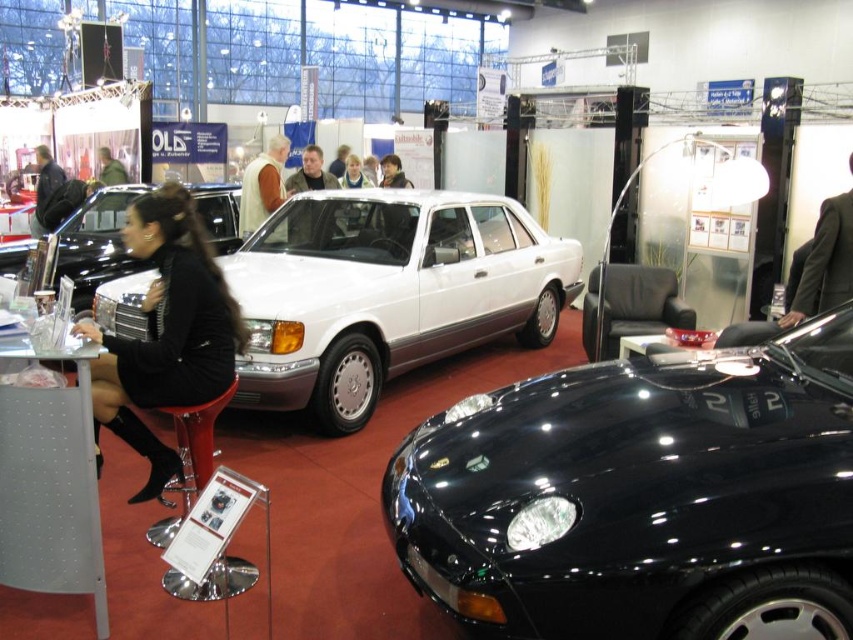
Between black fabric dress at lower left and shiny black car at center, which one is positioned higher?

shiny black car at center

Between black fabric dress at lower left and shiny black car at center, which one is positioned lower?

black fabric dress at lower left

Who is more distant from viewer, (136, 224) or (102, 228)?

Point (102, 228)

The height and width of the screenshot is (640, 853). I want to click on black fabric dress at lower left, so click(x=166, y=332).

Which is more to the right, white metallic sedan at center or dark gray suit at right?

dark gray suit at right is more to the right.

Which of these two, white metallic sedan at center or dark gray suit at right, stands taller?

white metallic sedan at center is taller.

Does point (323, 358) come farther from viewer compared to point (814, 310)?

No, it is in front of (814, 310).

Identify the location of white metallic sedan at center. The height and width of the screenshot is (640, 853). (386, 292).

Is point (567, 522) positioned behind point (253, 220)?

No, (567, 522) is in front of (253, 220).

Which is more to the left, glossy black car at lower right or light brown leather jacket at center?

light brown leather jacket at center is more to the left.

Is point (416, 515) positioned in front of point (253, 172)?

Yes, it is in front of point (253, 172).

You are a GUI agent. You are given a task and a screenshot of the screen. Output one action in this format:
    pyautogui.click(x=<x>, y=<y>)
    Task: Click on the glossy black car at lower right
    
    Given the screenshot: What is the action you would take?
    pyautogui.click(x=641, y=497)